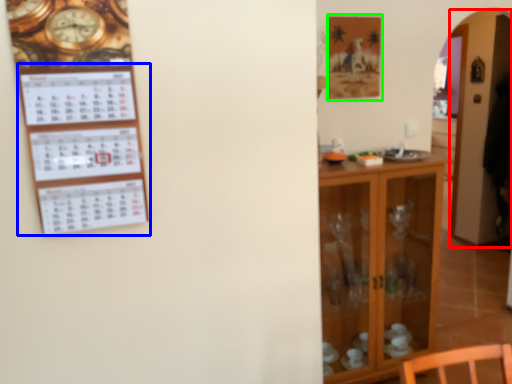
Question: Estimate the real-world distances between objects in this image. Which object is farther from glass door (highlighted by a red box), bulletin board (highlighted by a blue box) or picture frame (highlighted by a green box)?

Choices:
 (A) bulletin board
 (B) picture frame

Answer: (A)